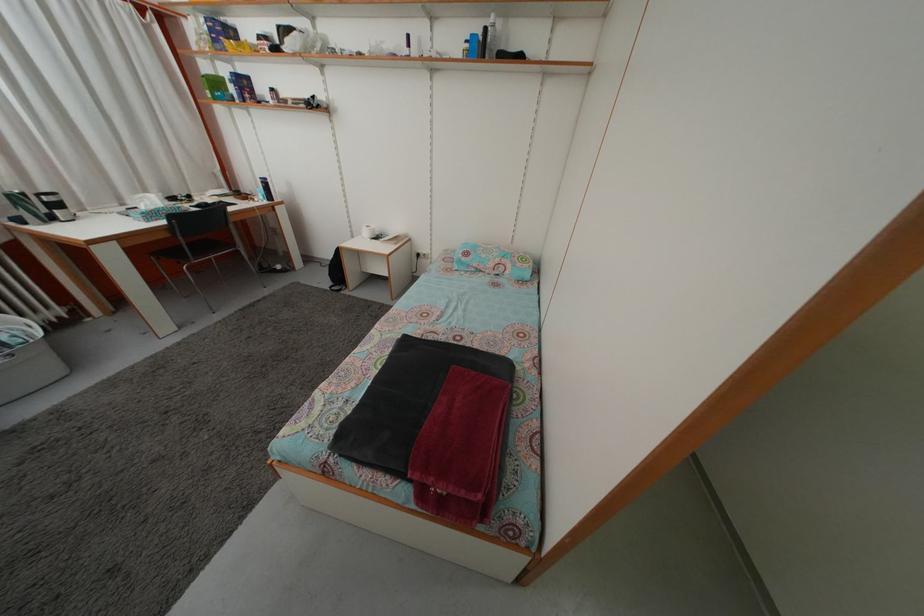
The location [472,45] corresponds to which object?

It corresponds to the blue plastic bottle in the image.